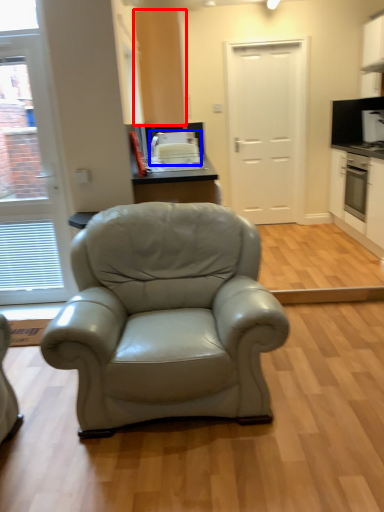
Question: Which point is further to the camera, cabinetry (highlighted by a red box) or appliance (highlighted by a blue box)?

Choices:
 (A) cabinetry
 (B) appliance

Answer: (B)